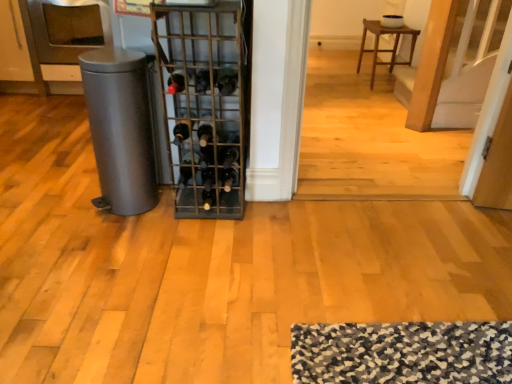
Find the location of a particular element. The image size is (512, 384). free space in front of brown wooden stool at upper center is located at coordinates [368, 97].